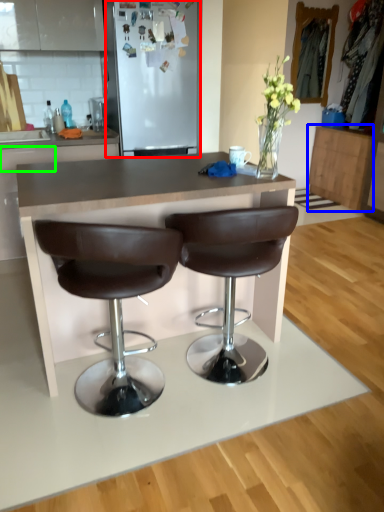
Question: Which object is positioned farthest from fridge (highlighted by a red box)? Select from cabinetry (highlighted by a blue box) and drawer (highlighted by a green box).

Choices:
 (A) cabinetry
 (B) drawer

Answer: (A)